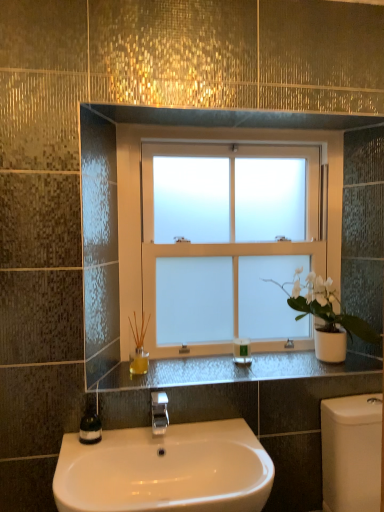
At what (x,y) coordinates should I click in order to perform the action: click on vacant area to the right of silver metallic faucet at center. Please return your answer as a coordinate pair (x, y). The width and height of the screenshot is (384, 512). Looking at the image, I should click on (211, 439).